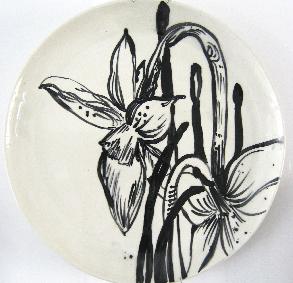
This screenshot has height=283, width=293. In order to click on flat surface in this screenshot , I will do `click(14, 243)`.